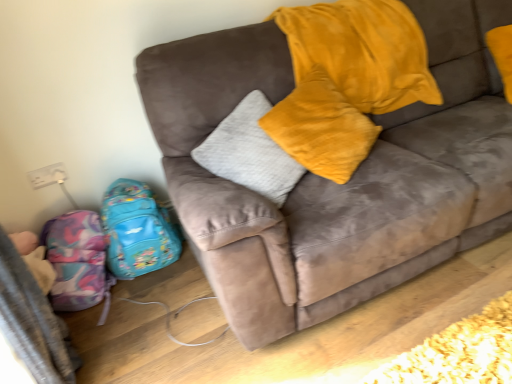
Question: Considering the relative positions of shiny blue backpack at lower left, which is counted as the 2th luggage, starting from the left, and multicolored fabric backpack at lower left, the second luggage in the right-to-left sequence, in the image provided, is shiny blue backpack at lower left, which is counted as the 2th luggage, starting from the left, in front of multicolored fabric backpack at lower left, the second luggage in the right-to-left sequence,?

Choices:
 (A) no
 (B) yes

Answer: (A)

Question: From the image's perspective, is shiny blue backpack at lower left, which ranks as the 1th luggage in right-to-left order, below multicolored fabric backpack at lower left, placed as the first luggage when sorted from left to right?

Choices:
 (A) yes
 (B) no

Answer: (B)

Question: Can you confirm if shiny blue backpack at lower left, which is counted as the 2th luggage, starting from the left, is bigger than multicolored fabric backpack at lower left, the second luggage in the right-to-left sequence?

Choices:
 (A) no
 (B) yes

Answer: (B)

Question: Can you confirm if shiny blue backpack at lower left, which is counted as the 2th luggage, starting from the left, is wider than multicolored fabric backpack at lower left, the second luggage in the right-to-left sequence?

Choices:
 (A) yes
 (B) no

Answer: (B)

Question: Can multicolored fabric backpack at lower left, the second luggage in the right-to-left sequence, be found inside shiny blue backpack at lower left, which is counted as the 2th luggage, starting from the left?

Choices:
 (A) yes
 (B) no

Answer: (B)

Question: Is shiny blue backpack at lower left, which ranks as the 1th luggage in right-to-left order, positioned beyond the bounds of multicolored fabric backpack at lower left, the second luggage in the right-to-left sequence?

Choices:
 (A) no
 (B) yes

Answer: (B)

Question: Is suede couch at center smaller than multicolored fabric backpack at lower left, the second luggage in the right-to-left sequence?

Choices:
 (A) no
 (B) yes

Answer: (A)

Question: From the image's perspective, does suede couch at center appear lower than multicolored fabric backpack at lower left, the second luggage in the right-to-left sequence?

Choices:
 (A) no
 (B) yes

Answer: (A)

Question: Is suede couch at center shorter than multicolored fabric backpack at lower left, placed as the first luggage when sorted from left to right?

Choices:
 (A) no
 (B) yes

Answer: (A)

Question: Does suede couch at center appear on the left side of multicolored fabric backpack at lower left, the second luggage in the right-to-left sequence?

Choices:
 (A) yes
 (B) no

Answer: (B)

Question: Are suede couch at center and multicolored fabric backpack at lower left, placed as the first luggage when sorted from left to right, beside each other?

Choices:
 (A) yes
 (B) no

Answer: (B)

Question: From a real-world perspective, is suede couch at center on top of multicolored fabric backpack at lower left, placed as the first luggage when sorted from left to right?

Choices:
 (A) no
 (B) yes

Answer: (B)

Question: Can you confirm if suede couch at center is positioned to the right of shiny blue backpack at lower left, which ranks as the 1th luggage in right-to-left order?

Choices:
 (A) no
 (B) yes

Answer: (B)